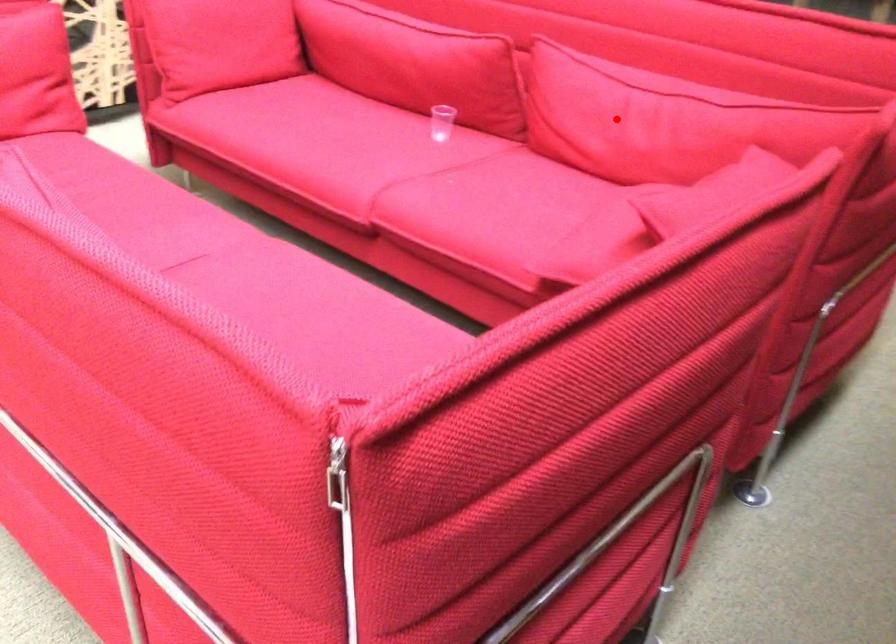
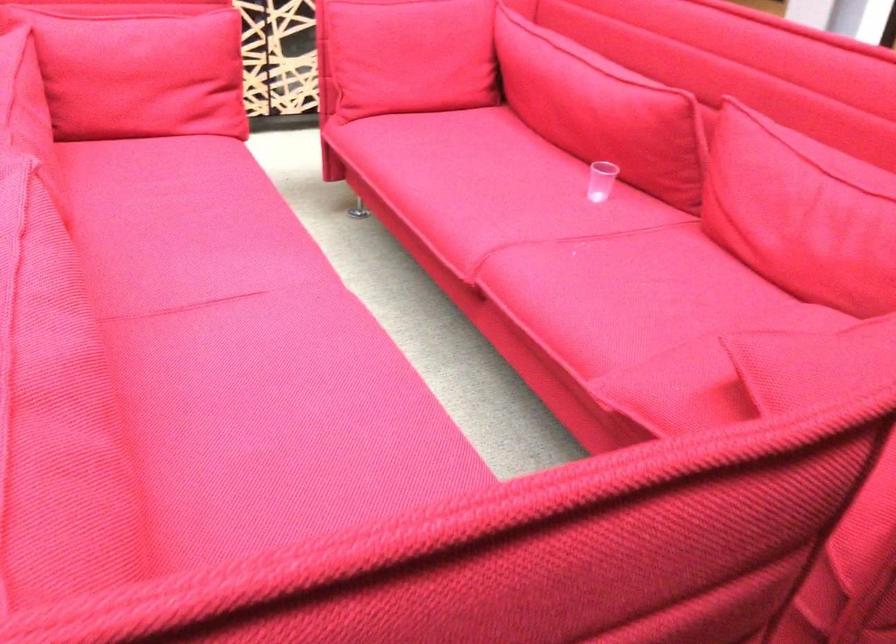
In the second image, find the point that corresponds to the highlighted location in the first image.

(800, 213)